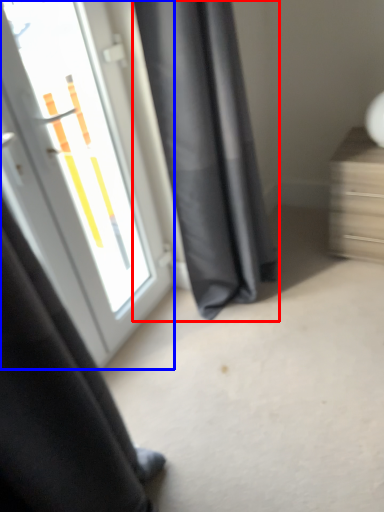
Question: Among these objects, which one is nearest to the camera, curtain (highlighted by a red box) or door (highlighted by a blue box)?

Choices:
 (A) curtain
 (B) door

Answer: (B)